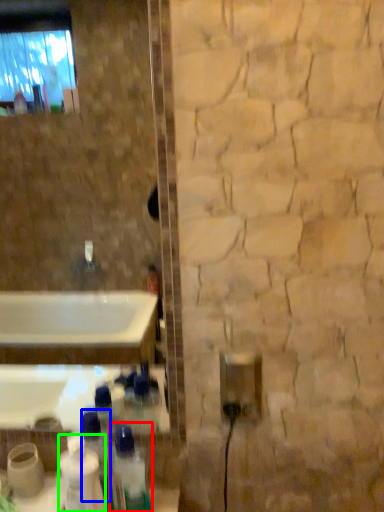
Question: Which object is positioned farthest from bottle (highlighted by a red box)? Select from bottle (highlighted by a blue box) and cleaning product (highlighted by a green box).

Choices:
 (A) bottle
 (B) cleaning product

Answer: (B)